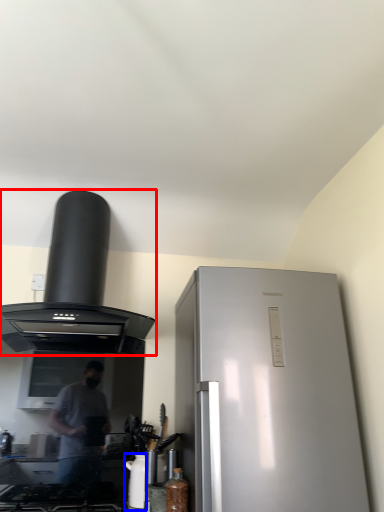
Question: Among these objects, which one is farthest to the camera, kitchen appliance (highlighted by a red box) or appliance (highlighted by a blue box)?

Choices:
 (A) kitchen appliance
 (B) appliance

Answer: (B)